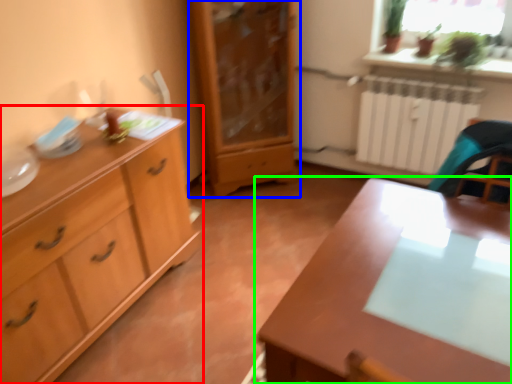
Question: Based on their relative distances, which object is nearer to chest of drawers (highlighted by a red box)? Choose from chest of drawers (highlighted by a blue box) and table (highlighted by a green box).

Choices:
 (A) chest of drawers
 (B) table

Answer: (B)